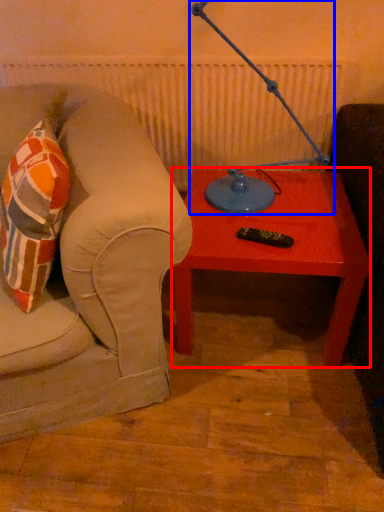
Question: Among these objects, which one is farthest to the camera, table (highlighted by a red box) or table lamp (highlighted by a blue box)?

Choices:
 (A) table
 (B) table lamp

Answer: (A)